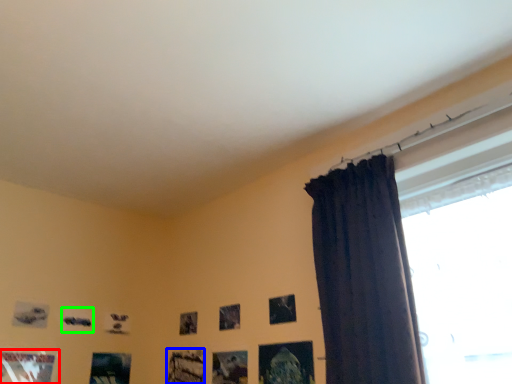
Question: Which is nearer to the picture frame (highlighted by a red box)? picture frame (highlighted by a blue box) or picture frame (highlighted by a green box).

Choices:
 (A) picture frame
 (B) picture frame

Answer: (B)